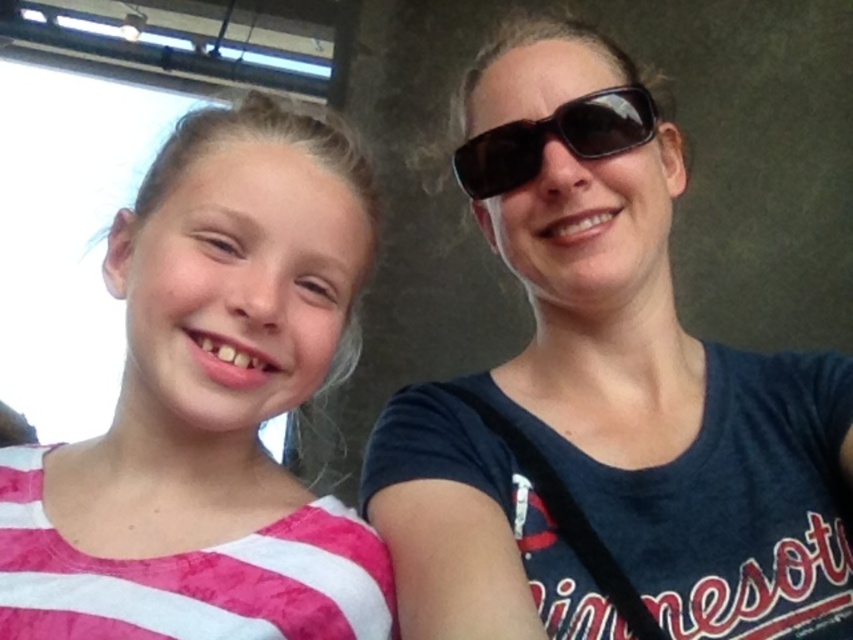
You are standing in the same location as the photographer taking the selfie. You want to move forward to the point closer to you. Which point should you move towards, point (x=70, y=636) or point (x=469, y=141)?

Point (x=70, y=636) is in front of point 0.223, (x=469, y=141). So you should move towards point (x=70, y=636) because it is closer to you.

You are a photographer trying to capture a clear photo of the matte black sunglasses at upper center. The camera is 23.41 inches away from the sunglasses. Is this distance sufficient to ensure the sunglasses appear in focus in the photo?

The matte black sunglasses at upper center and camera are 23.41 inches apart from each other. This distance should be sufficient for the sunglasses to appear in focus, assuming proper camera settings and stability.

You are holding a camera to take a photo of a point at coordinates point (x=396, y=404). The camera has a minimum focus distance of 30 inches. Will the camera be able to focus on the point?

The distance of point (x=396, y=404) from camera is 33.59 inches, which is greater than the minimum focus distance of 30 inches. Therefore, the camera should be able to focus on the point.